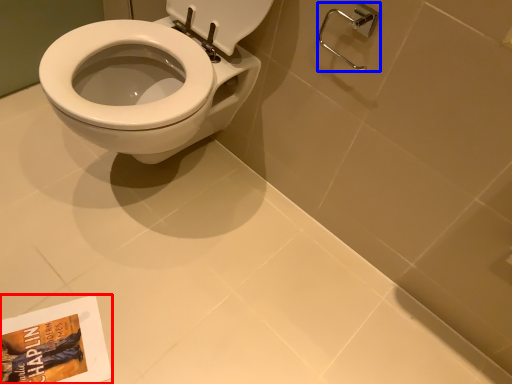
Question: Which object is further to the camera taking this photo, paperback book (highlighted by a red box) or shower (highlighted by a blue box)?

Choices:
 (A) paperback book
 (B) shower

Answer: (A)